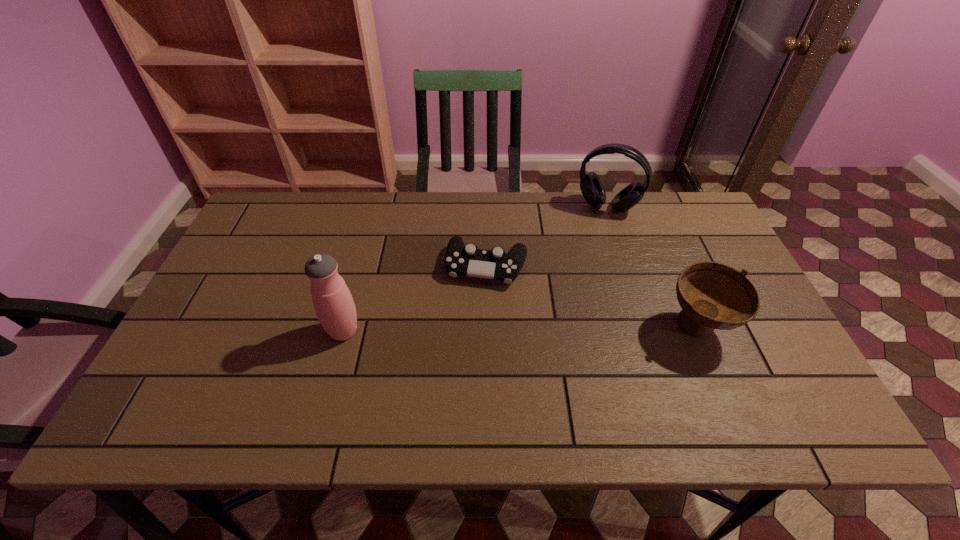
Identify the location of free region at the near left corner of the desktop. This screenshot has height=540, width=960. (225, 377).

The width and height of the screenshot is (960, 540). Find the location of `vacant space that is in between the soup bowl and the farthest object`. vacant space that is in between the soup bowl and the farthest object is located at coordinates coord(653,267).

At what (x,y) coordinates should I click in order to perform the action: click on vacant space that is in between the second farthest object and the third tallest object. Please return your answer as a coordinate pair (x, y). The width and height of the screenshot is (960, 540). Looking at the image, I should click on (592, 297).

At what (x,y) coordinates should I click in order to perform the action: click on free space between the second shortest object and the farthest object. Please return your answer as a coordinate pair (x, y). This screenshot has height=540, width=960. Looking at the image, I should click on (653, 267).

Locate an element on the screen. This screenshot has height=540, width=960. unoccupied position between the leftmost object and the shortest object is located at coordinates (415, 299).

The height and width of the screenshot is (540, 960). Identify the location of unoccupied position between the control and the farthest object. (547, 237).

Where is `free point between the shortest object and the thermos bottle`? free point between the shortest object and the thermos bottle is located at coordinates (415, 299).

Find the location of a particular element. This screenshot has height=540, width=960. vacant space that is in between the second shortest object and the headset is located at coordinates (653, 267).

Where is `unoccupied area between the thermos bottle and the soup bowl`? This screenshot has height=540, width=960. unoccupied area between the thermos bottle and the soup bowl is located at coordinates click(x=520, y=330).

The width and height of the screenshot is (960, 540). I want to click on vacant space that is in between the leftmost object and the control, so click(x=415, y=299).